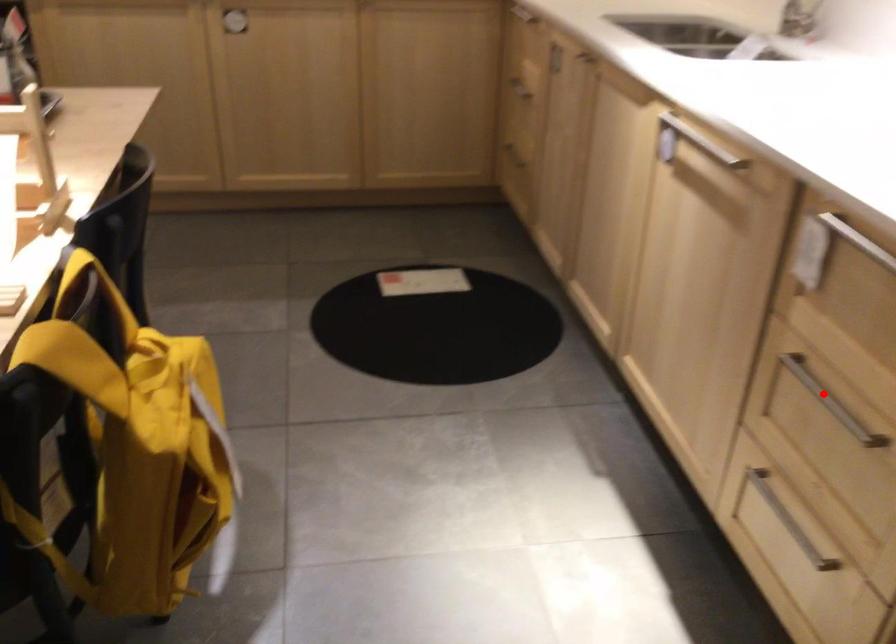
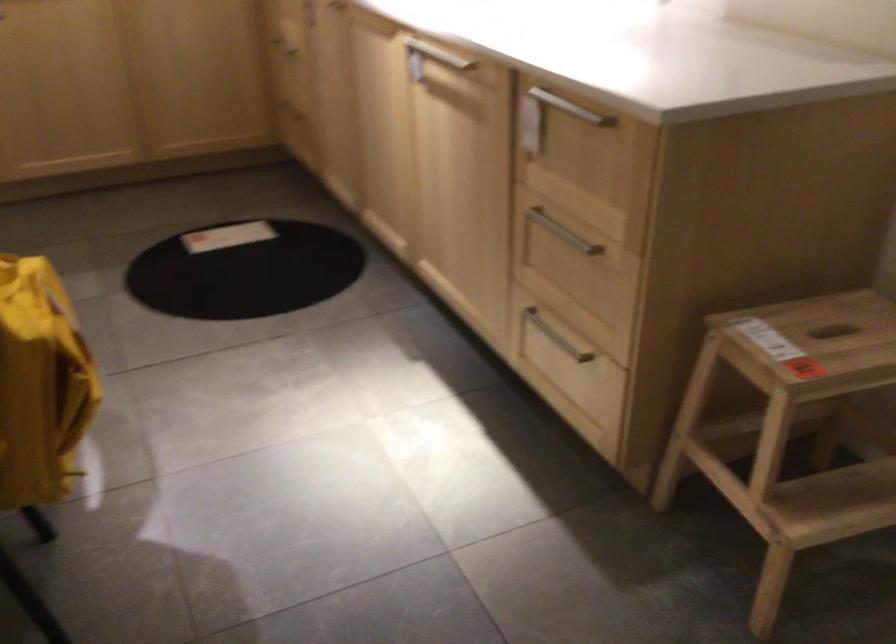
Where in the second image is the point corresponding to the highlighted location from the first image?

(563, 232)